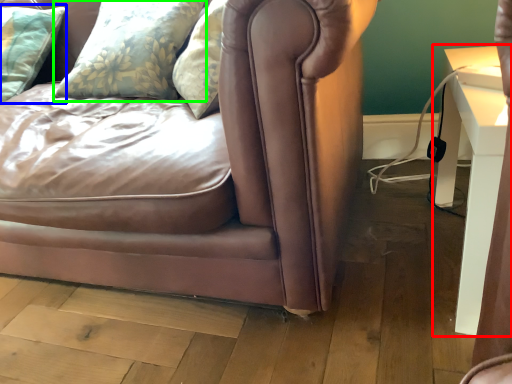
Question: Based on their relative distances, which object is nearer to table (highlighted by a red box)? Choose from pillow (highlighted by a blue box) and pillow (highlighted by a green box).

Choices:
 (A) pillow
 (B) pillow

Answer: (B)